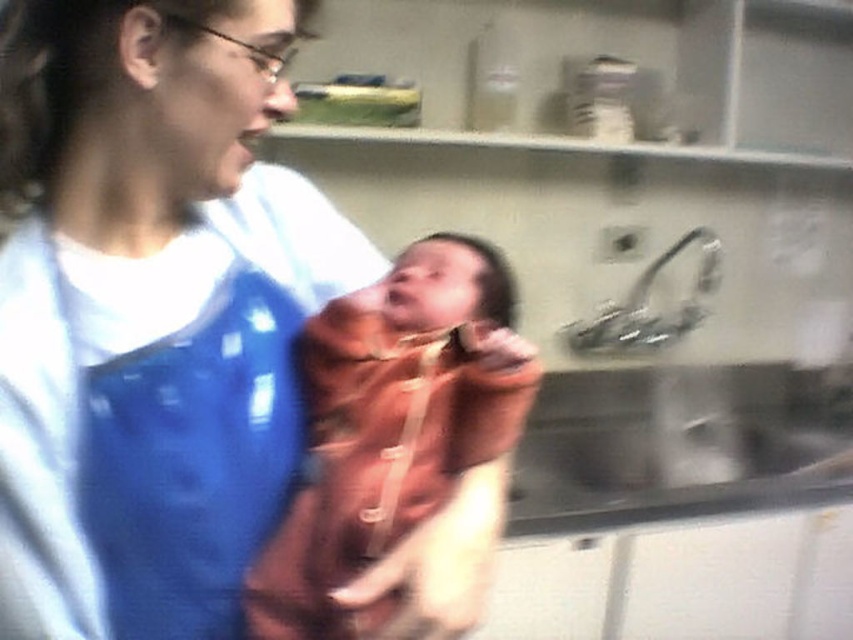
You are a healthcare worker in the room. You need to place a small medical kit on the floor near the blue fabric shirt at center. Where should you place it?

The blue fabric shirt at center is located at point [149,310], so you should place the medical kit near that coordinate.

You are a medical student observing a delivery room scene. You notice the point at coordinates (149, 310). Which object is located at that point?

The point at coordinates (149, 310) is where the blue fabric shirt at center is located.

You are a medical student observing a healthcare provider in a delivery room. You notice the blue fabric shirt at center and the soft brown blanket at center. Which object is positioned higher in the image?

The blue fabric shirt at center is taller than the soft brown blanket at center, so the blue fabric shirt at center is positioned higher in the image.